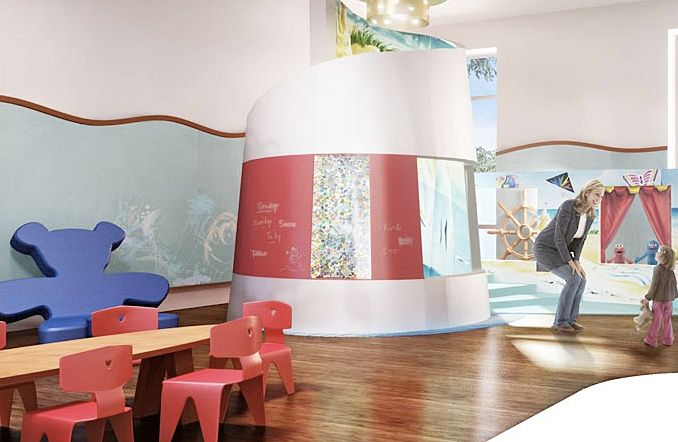
Where is `room light`? room light is located at coordinates (399, 4).